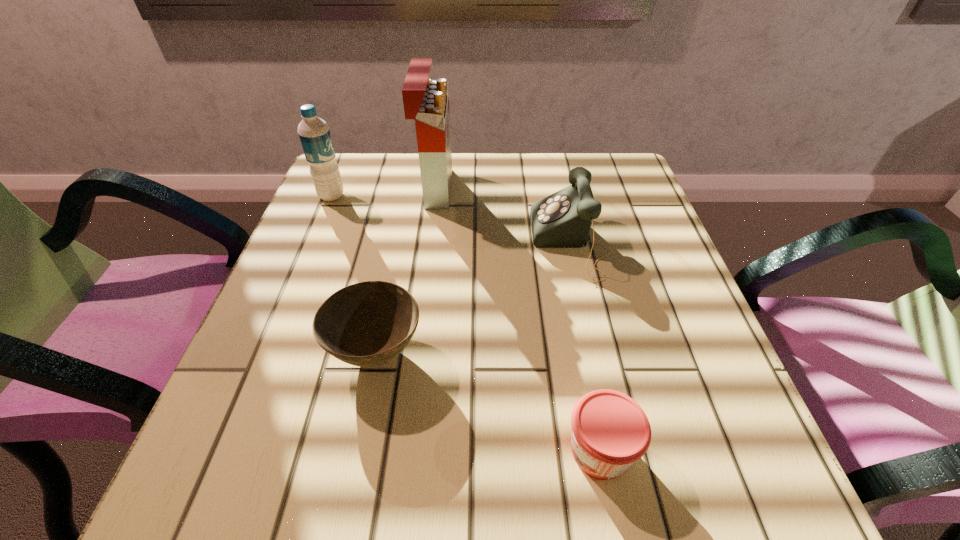
Find the location of a particular element. Image resolution: width=960 pixels, height=540 pixels. free space that satisfies the following two spatial constraints: 1. on the label of the bowl; 2. on the right side of the water bottle is located at coordinates (267, 353).

I want to click on vacant space that satisfies the following two spatial constraints: 1. on the label of the bowl; 2. on the left side of the water bottle, so click(267, 353).